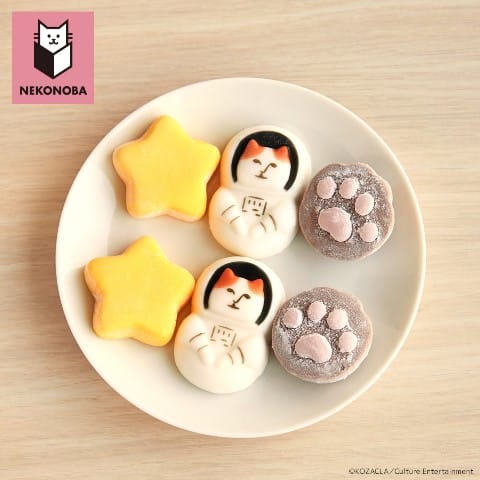
Where is `light wood table`? The height and width of the screenshot is (480, 480). light wood table is located at coordinates (271, 43).